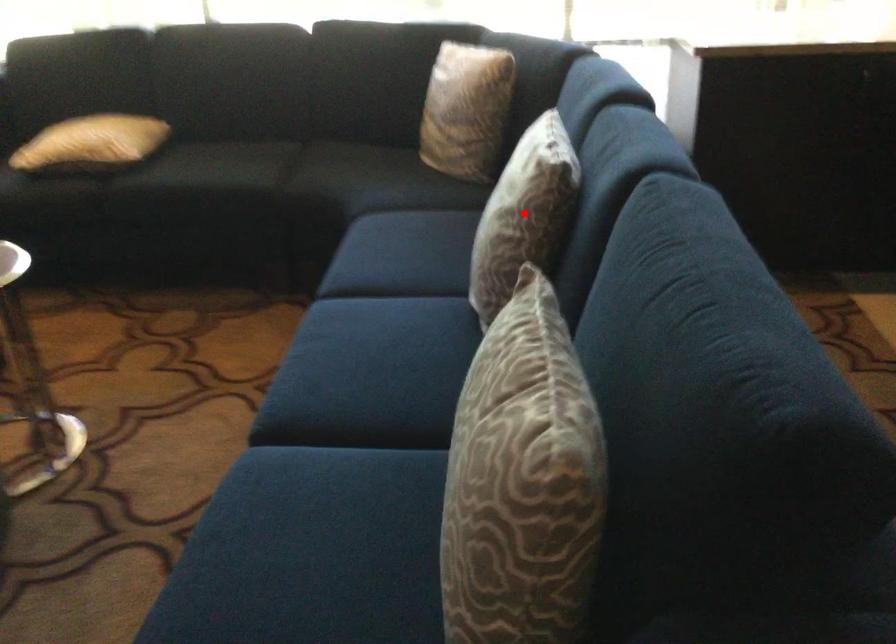
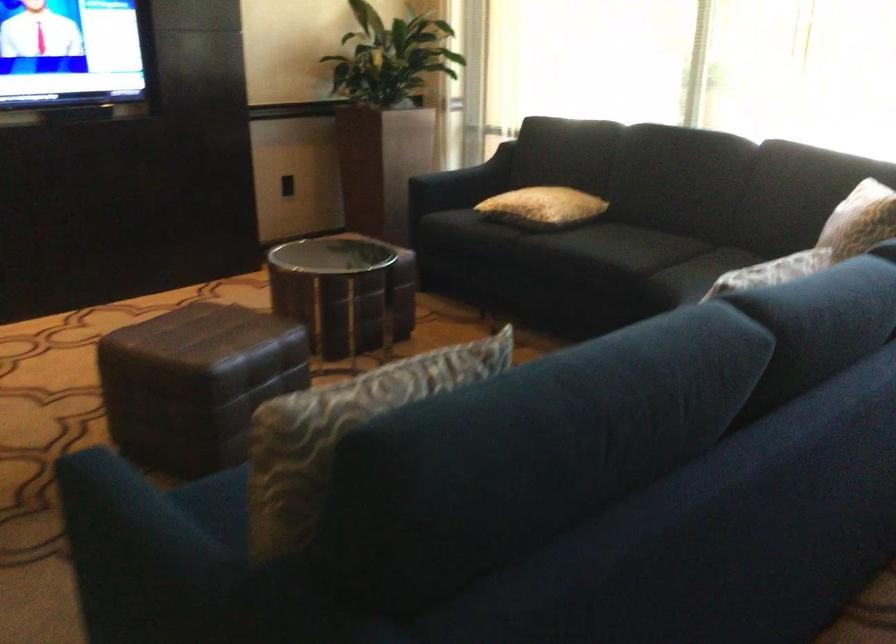
Question: I am providing you with two images of the same scene from different viewpoints. A red point is marked on the first image. At the location where the point appears in image 1, is it still visible in image 2?

Choices:
 (A) Yes
 (B) No

Answer: (B)